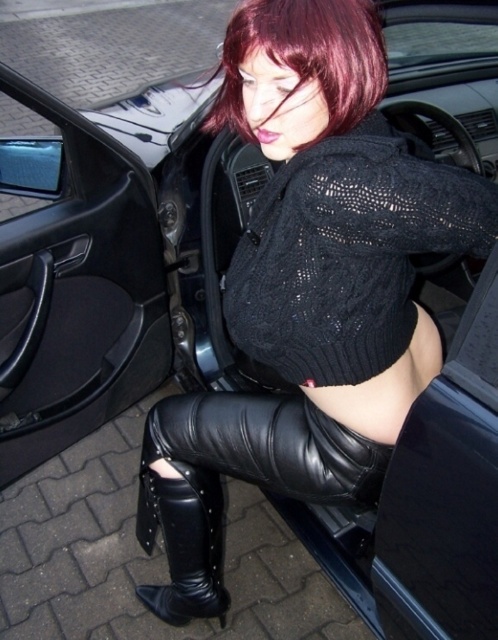
Based on the photo, measure the distance between shiny burgundy hair at upper center and black leather boot at lower center.

A distance of 3.30 feet exists between shiny burgundy hair at upper center and black leather boot at lower center.

Who is more distant from viewer, (299, 83) or (177, 497)?

The point (177, 497) is more distant.

Is point (228, 88) closer to camera compared to point (158, 499)?

Yes, point (228, 88) is closer to viewer.

This screenshot has height=640, width=498. I want to click on shiny burgundy hair at upper center, so click(304, 60).

Is black leather car door at lower left below black leather boot at lower center?

No, black leather car door at lower left is not below black leather boot at lower center.

Who is more forward, (29, 88) or (215, 563)?

Point (29, 88) is more forward.

Find the location of a particular element. Image resolution: width=498 pixels, height=640 pixels. black leather car door at lower left is located at coordinates (73, 278).

Can you confirm if black leather car door at lower left is positioned to the right of black leather pants at lower center?

No, black leather car door at lower left is not to the right of black leather pants at lower center.

Who is more distant from viewer, (26, 388) or (183, 404)?

The point (26, 388) is more distant.

Who is more distant from viewer, (49,321) or (142,451)?

The point (49,321) is behind.

At what (x,y) coordinates should I click in order to perform the action: click on black leather car door at lower left. Please return your answer as a coordinate pair (x, y). Looking at the image, I should click on (73, 278).